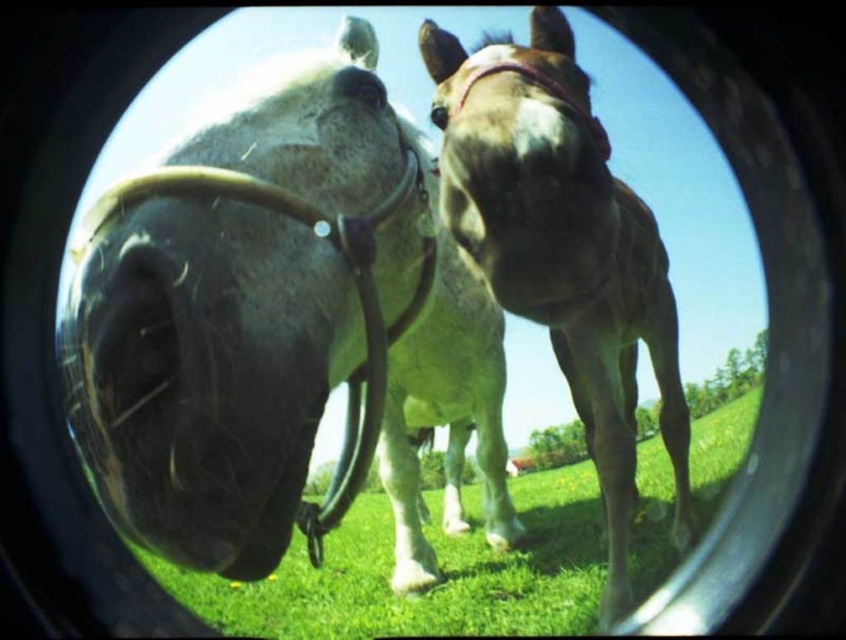
You are a photographer standing in the field. You want to take a photo of the black leather nose at center and the green grass at lower center. Which object is positioned to the right of the other?

The green grass at lower center is to the right of the black leather nose at center according to the description.